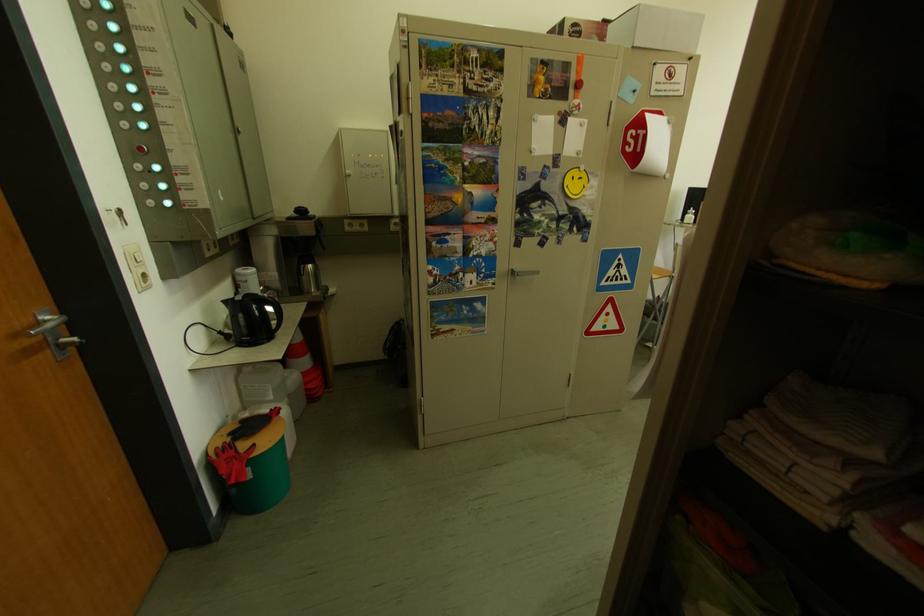
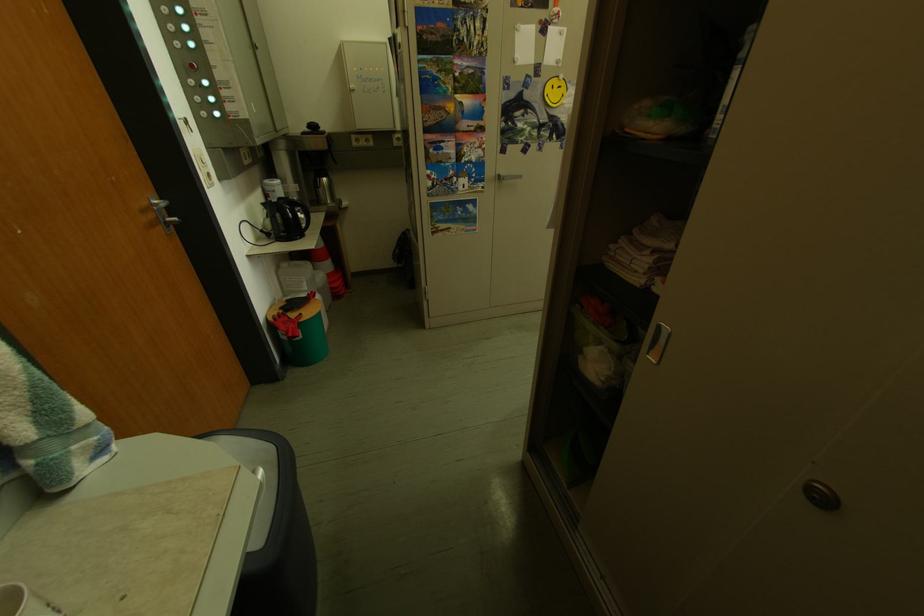
In the second image, find the point that corresponds to (x=362, y=179) in the first image.

(367, 92)